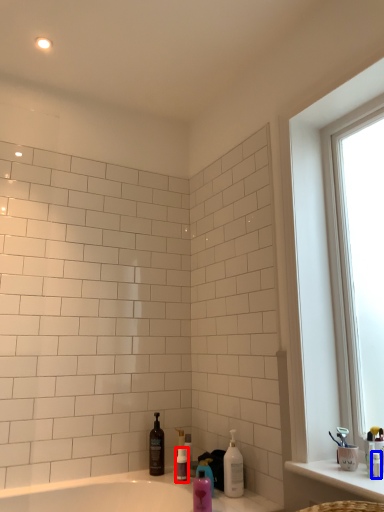
Question: Which object appears closest to the camera in this image, toiletry (highlighted by a red box) or toiletry (highlighted by a blue box)?

Choices:
 (A) toiletry
 (B) toiletry

Answer: (B)